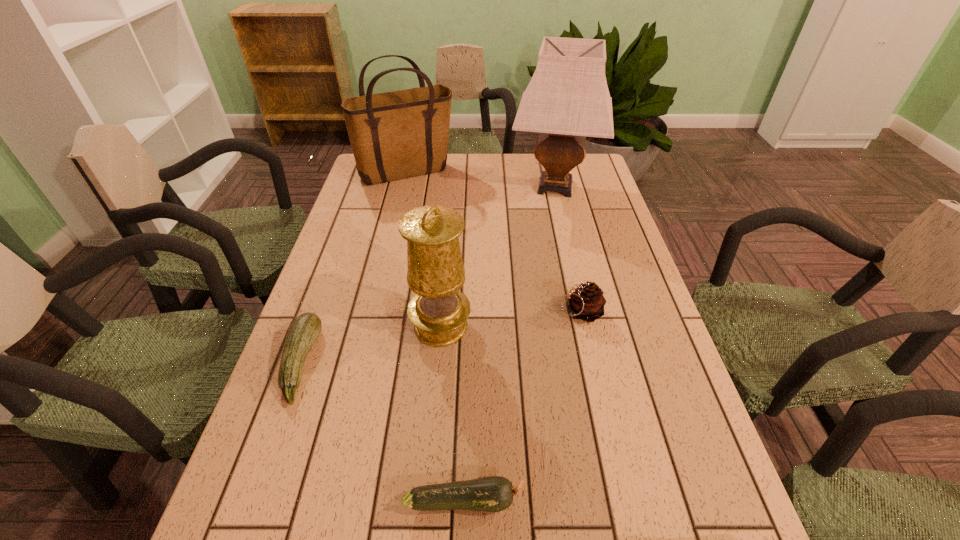
The height and width of the screenshot is (540, 960). In order to click on the tallest object in this screenshot , I will do `click(567, 99)`.

This screenshot has width=960, height=540. Identify the location of tote bag. (400, 134).

Find the location of a particular element. Image resolution: width=960 pixels, height=540 pixels. oil lamp is located at coordinates (435, 272).

Image resolution: width=960 pixels, height=540 pixels. Identify the location of pinecone. (587, 303).

This screenshot has height=540, width=960. In order to click on the farther zucchini in this screenshot , I will do `click(305, 329)`.

Image resolution: width=960 pixels, height=540 pixels. Find the location of `the left zucchini`. the left zucchini is located at coordinates (305, 329).

The image size is (960, 540). I want to click on the nearer zucchini, so click(493, 493).

Identify the location of the right zucchini. This screenshot has height=540, width=960. (493, 493).

Where is `blank space located 0.070m on the front of the lampshade`? The width and height of the screenshot is (960, 540). blank space located 0.070m on the front of the lampshade is located at coordinates (564, 228).

Find the location of a particular element. This screenshot has width=960, height=540. vacant area located 0.300m on the right of the tote bag is located at coordinates (539, 172).